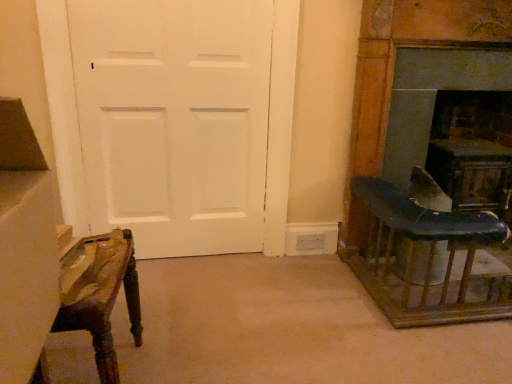
Question: Is blue leather chair at right further to the viewer compared to dark gray stone fireplace at right?

Choices:
 (A) no
 (B) yes

Answer: (A)

Question: Does blue leather chair at right have a lesser width compared to dark gray stone fireplace at right?

Choices:
 (A) yes
 (B) no

Answer: (A)

Question: Does blue leather chair at right have a greater width compared to dark gray stone fireplace at right?

Choices:
 (A) yes
 (B) no

Answer: (B)

Question: Is dark gray stone fireplace at right surrounded by blue leather chair at right?

Choices:
 (A) yes
 (B) no

Answer: (B)

Question: Can you confirm if blue leather chair at right is positioned to the left of dark gray stone fireplace at right?

Choices:
 (A) yes
 (B) no

Answer: (A)

Question: Is white matte door at left taller or shorter than dark gray stone fireplace at right?

Choices:
 (A) short
 (B) tall

Answer: (B)

Question: In terms of size, does white matte door at left appear bigger or smaller than dark gray stone fireplace at right?

Choices:
 (A) big
 (B) small

Answer: (B)

Question: Is point (x=209, y=86) positioned closer to the camera than point (x=415, y=150)?

Choices:
 (A) farther
 (B) closer

Answer: (B)

Question: Would you say white matte door at left is to the left or to the right of dark gray stone fireplace at right in the picture?

Choices:
 (A) right
 (B) left

Answer: (B)

Question: From the image's perspective, is dark gray stone fireplace at right above or below white matte door at left?

Choices:
 (A) below
 (B) above

Answer: (A)

Question: Do you think dark gray stone fireplace at right is within white matte door at left, or outside of it?

Choices:
 (A) inside
 (B) outside

Answer: (B)

Question: From a real-world perspective, is dark gray stone fireplace at right positioned above or below white matte door at left?

Choices:
 (A) below
 (B) above

Answer: (A)

Question: Is dark gray stone fireplace at right taller or shorter than white matte door at left?

Choices:
 (A) tall
 (B) short

Answer: (B)

Question: Is white matte door at left to the left or to the right of wooden chair at right in the image?

Choices:
 (A) right
 (B) left

Answer: (B)

Question: Relative to wooden chair at right, is white matte door at left in front or behind?

Choices:
 (A) front
 (B) behind

Answer: (B)